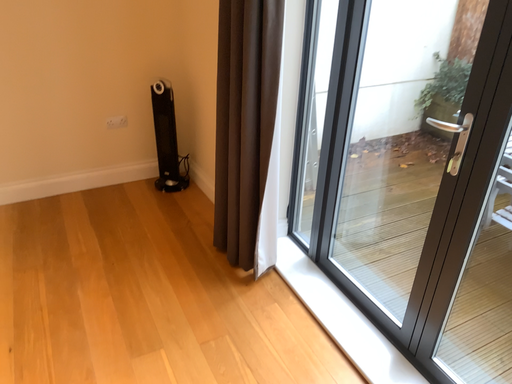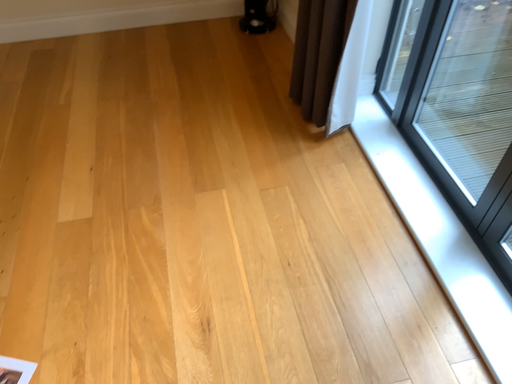
Question: How did the camera likely rotate when shooting the video?

Choices:
 (A) rotated left
 (B) rotated right

Answer: (A)